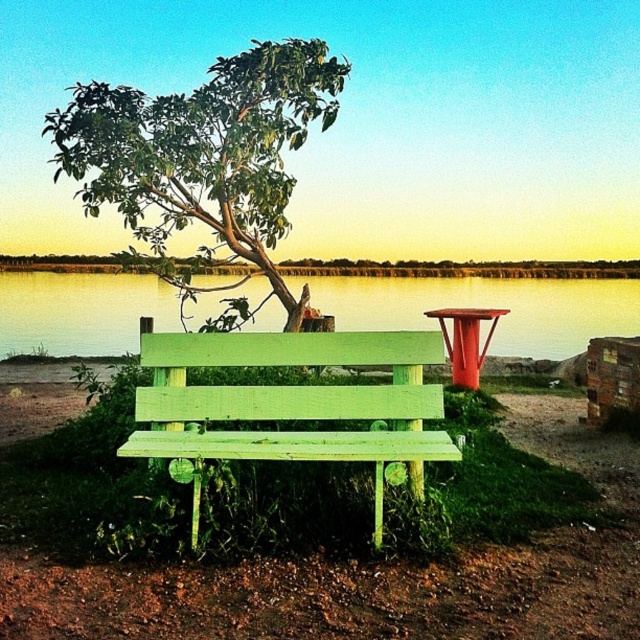
Question: Can you confirm if green leafy tree at upper center is bigger than green wooden water at center?

Choices:
 (A) no
 (B) yes

Answer: (A)

Question: Among these points, which one is nearest to the camera?

Choices:
 (A) (180, 273)
 (B) (49, 276)

Answer: (A)

Question: Does green painted wood bench at center have a greater width compared to green wooden water at center?

Choices:
 (A) no
 (B) yes

Answer: (A)

Question: Which point is closer to the camera taking this photo?

Choices:
 (A) (36, 308)
 (B) (268, 280)

Answer: (B)

Question: Which object is farther from the camera taking this photo?

Choices:
 (A) green leafy tree at upper center
 (B) green wooden water at center

Answer: (B)

Question: Is green leafy tree at upper center thinner than green wooden water at center?

Choices:
 (A) yes
 (B) no

Answer: (A)